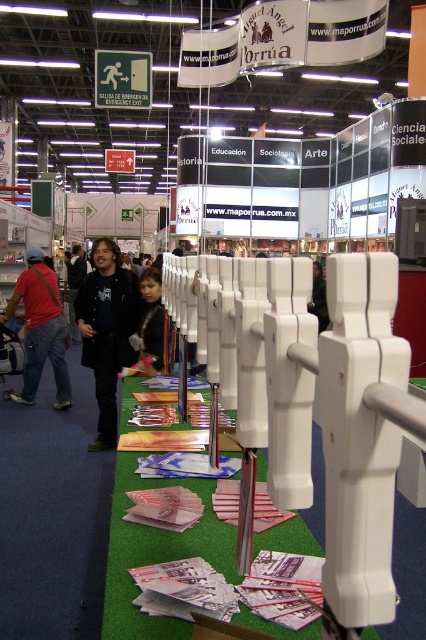
Does black matte jacket at left have a larger size compared to dark brown hair at center?

Indeed, black matte jacket at left has a larger size compared to dark brown hair at center.

Is black matte jacket at left thinner than dark brown hair at center?

No.

Which is behind, point (104, 349) or point (149, 333)?

Point (104, 349)

This screenshot has width=426, height=640. Identify the location of black matte jacket at left. (106, 330).

Which is in front, point (8, 316) or point (322, 307)?

Point (8, 316)

Between matte red shirt at left and black fabric at center, which one is positioned higher?

black fabric at center is above.

Is point (55, 310) in front of point (311, 294)?

No, (55, 310) is behind (311, 294).

Find the location of a particular element. This screenshot has height=640, width=426. matte red shirt at left is located at coordinates (40, 330).

Which is behind, point (141, 275) or point (72, 304)?

Point (72, 304)

Does dark brown hair at center come behind matte black jacket at center?

No.

Where is `dark brown hair at center`? Image resolution: width=426 pixels, height=640 pixels. dark brown hair at center is located at coordinates (150, 320).